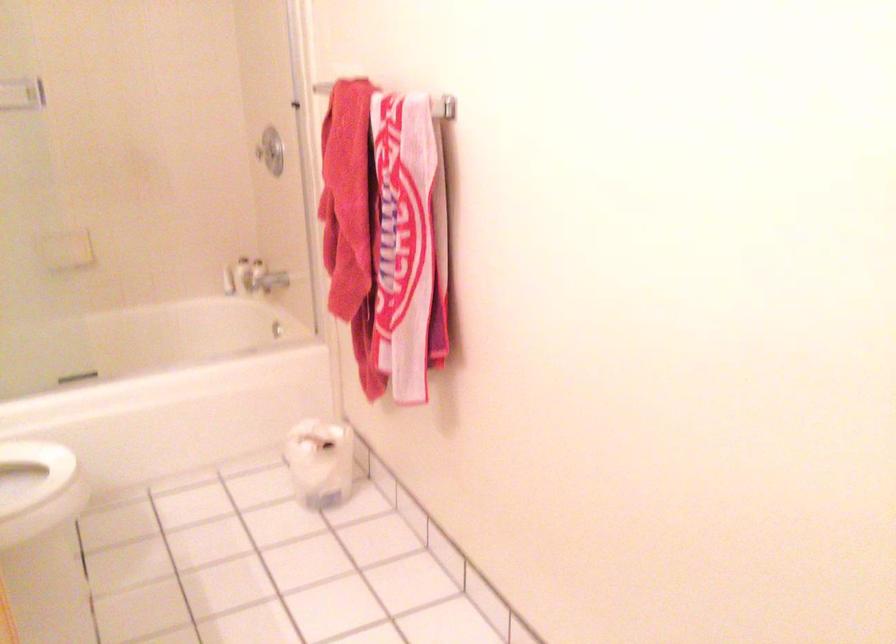
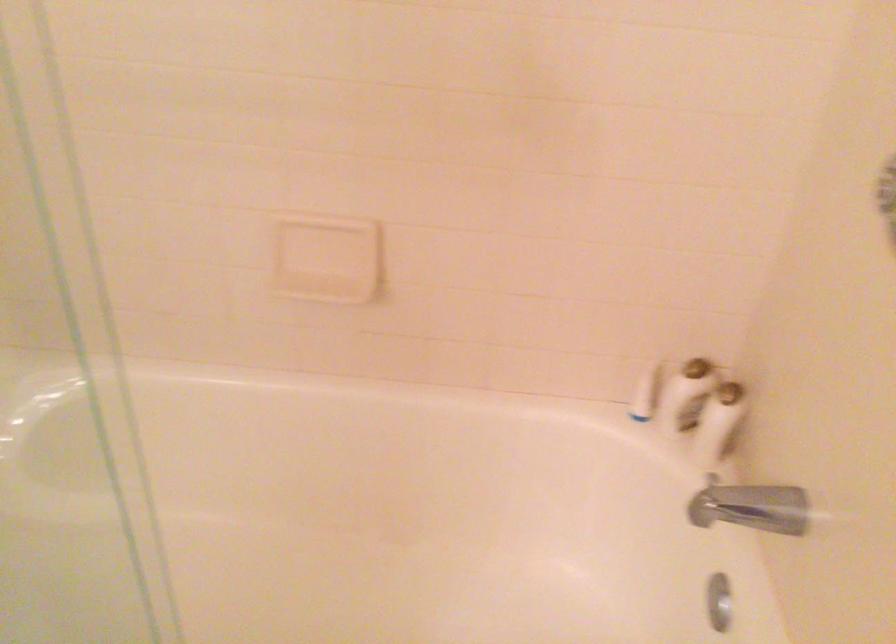
In the second image, find the point that corresponds to (x=271, y=275) in the first image.

(757, 507)